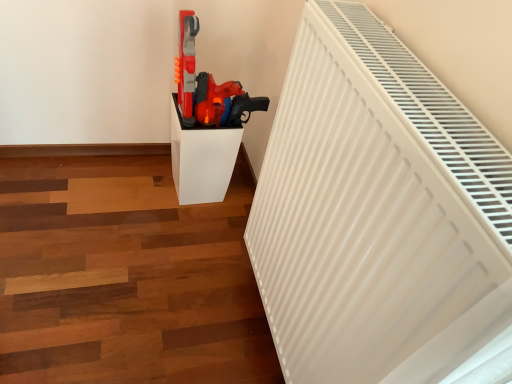
Question: Is matte plastic toy gun at center positioned with its back to white matte radiator at upper right?

Choices:
 (A) yes
 (B) no

Answer: (B)

Question: Is matte plastic toy gun at center not near white matte radiator at upper right?

Choices:
 (A) no
 (B) yes

Answer: (A)

Question: Could you tell me if matte plastic toy gun at center is turned towards white matte radiator at upper right?

Choices:
 (A) no
 (B) yes

Answer: (A)

Question: Can you confirm if matte plastic toy gun at center is smaller than white matte radiator at upper right?

Choices:
 (A) no
 (B) yes

Answer: (B)

Question: From a real-world perspective, is matte plastic toy gun at center located beneath white matte radiator at upper right?

Choices:
 (A) yes
 (B) no

Answer: (B)

Question: Is matte plastic toy gun at center positioned behind white matte radiator at upper right?

Choices:
 (A) yes
 (B) no

Answer: (A)

Question: Considering the relative positions of matte plastic toy gun at center and white glossy pedestal at center in the image provided, is matte plastic toy gun at center to the left of white glossy pedestal at center from the viewer's perspective?

Choices:
 (A) no
 (B) yes

Answer: (A)

Question: Is matte plastic toy gun at center outside white glossy pedestal at center?

Choices:
 (A) yes
 (B) no

Answer: (A)

Question: Is matte plastic toy gun at center in front of white glossy pedestal at center?

Choices:
 (A) no
 (B) yes

Answer: (A)

Question: Is matte plastic toy gun at center directly adjacent to white glossy pedestal at center?

Choices:
 (A) no
 (B) yes

Answer: (A)

Question: Is matte plastic toy gun at center bigger than white glossy pedestal at center?

Choices:
 (A) yes
 (B) no

Answer: (B)

Question: From the image's perspective, is matte plastic toy gun at center above white glossy pedestal at center?

Choices:
 (A) no
 (B) yes

Answer: (B)

Question: Considering the relative sizes of white matte radiator at upper right and white glossy pedestal at center in the image provided, is white matte radiator at upper right thinner than white glossy pedestal at center?

Choices:
 (A) yes
 (B) no

Answer: (A)